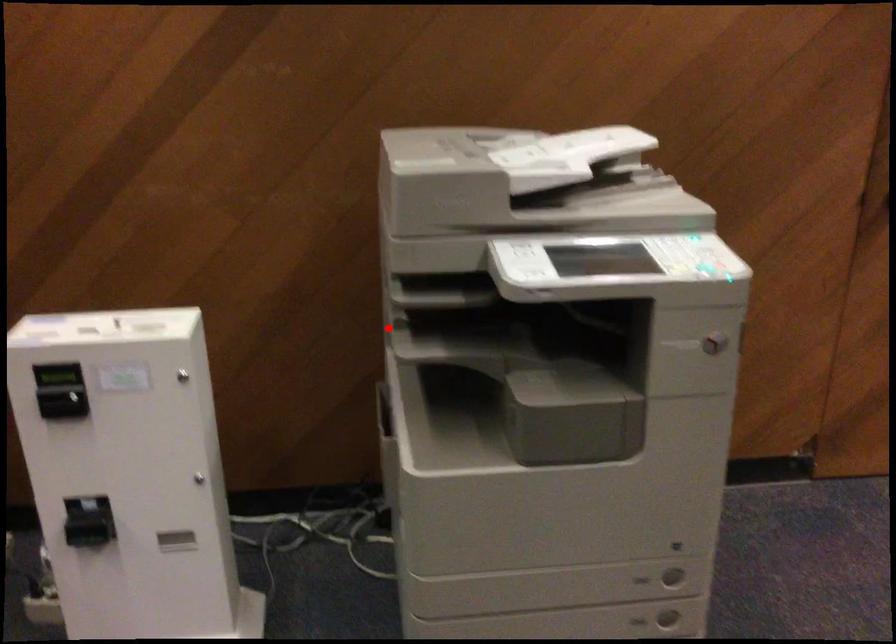
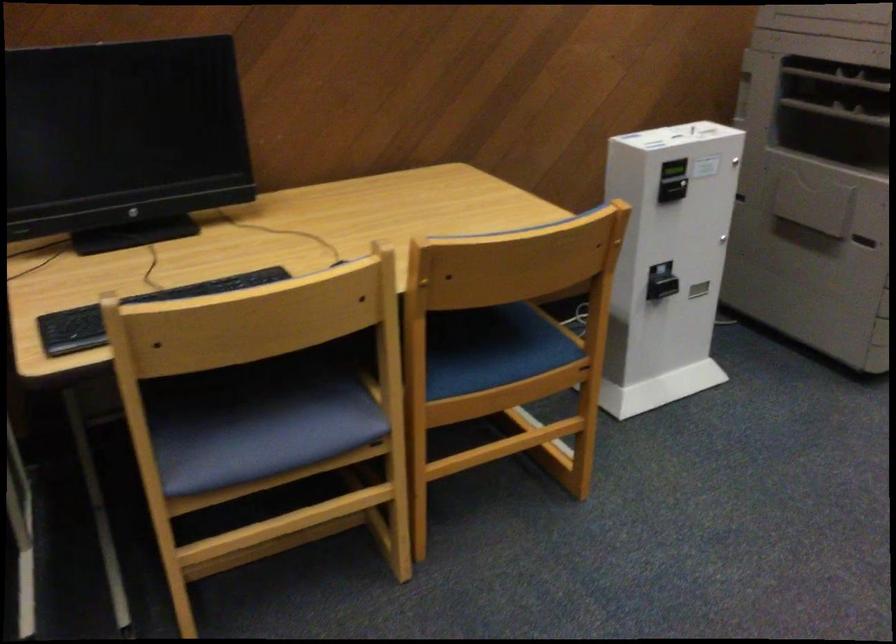
Question: I am providing you with two images of the same scene from different viewpoints. A red point is shown in image1. For the corresponding object point in image2, is it positioned nearer or farther from the camera?

Choices:
 (A) Nearer
 (B) Farther

Answer: (B)